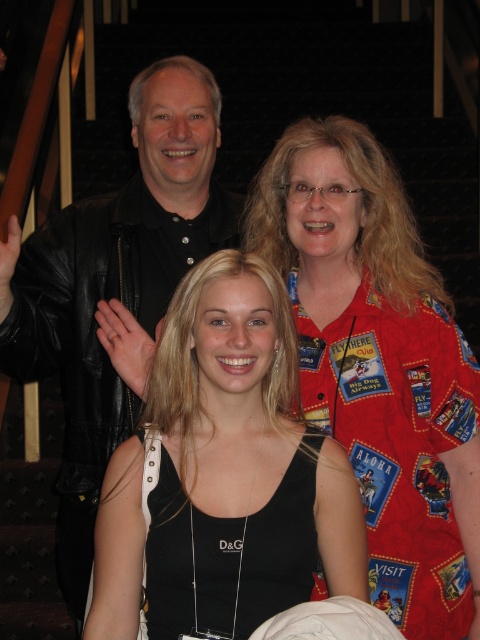
Question: Observing the image, what is the correct spatial positioning of red patchwork shirt at upper right in reference to black fabric tank top at center?

Choices:
 (A) right
 (B) left

Answer: (A)

Question: Among these points, which one is nearest to the camera?

Choices:
 (A) (314, 557)
 (B) (232, 227)
 (C) (335, 211)
 (D) (275, 404)

Answer: (A)

Question: Which object is positioned farthest from the black leather jacket at upper left?

Choices:
 (A) black fabric dress at center
 (B) red patchwork shirt at upper right
 (C) black fabric tank top at center

Answer: (A)

Question: Is red patchwork shirt at upper right smaller than black fabric tank top at center?

Choices:
 (A) yes
 (B) no

Answer: (B)

Question: Which point appears closest to the camera in this image?

Choices:
 (A) (228, 209)
 (B) (168, 353)
 (C) (313, 355)
 (D) (322, 436)

Answer: (D)

Question: Is red patchwork shirt at upper right to the left of black fabric tank top at center from the viewer's perspective?

Choices:
 (A) yes
 (B) no

Answer: (B)